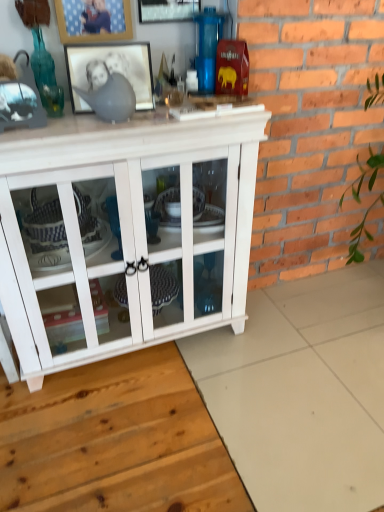
This screenshot has width=384, height=512. I want to click on free space above white wood cabinet at center (from a real-world perspective), so click(x=117, y=117).